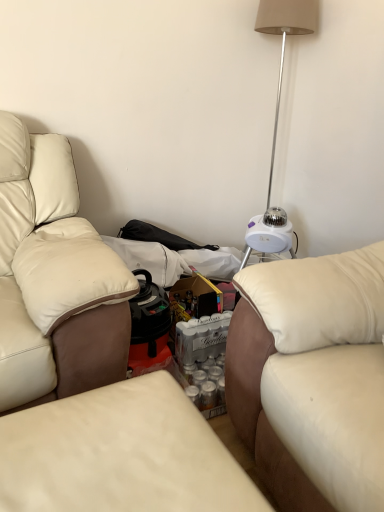
Question: Considering their positions, is white leather studio couch at right, the second studio couch viewed from the left, located in front of or behind leather couch at center, which ranks as the 1th studio couch in left-to-right order?

Choices:
 (A) behind
 (B) front

Answer: (A)

Question: From a real-world perspective, is white leather studio couch at right, the first studio couch in the right-to-left sequence, physically located above or below leather couch at center, marked as the second studio couch in a right-to-left arrangement?

Choices:
 (A) above
 (B) below

Answer: (A)

Question: Which is farther from the leather couch at center, which ranks as the 1th studio couch in left-to-right order?

Choices:
 (A) white leather studio couch at right, the first studio couch in the right-to-left sequence
 (B) white plastic table lamp at upper right

Answer: (B)

Question: Estimate the real-world distances between objects in this image. Which object is farther from the leather couch at center, marked as the second studio couch in a right-to-left arrangement?

Choices:
 (A) white leather studio couch at right, the first studio couch in the right-to-left sequence
 (B) white plastic table lamp at upper right

Answer: (B)